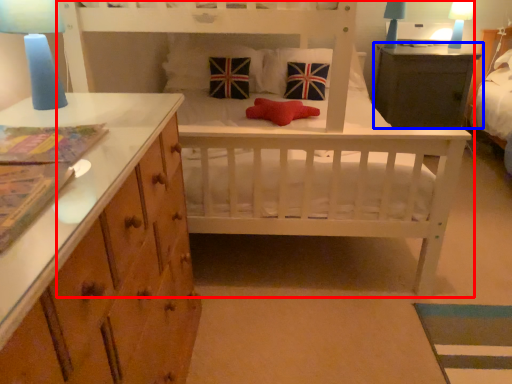
Question: Which object appears farthest to the camera in this image, infant bed (highlighted by a red box) or table (highlighted by a blue box)?

Choices:
 (A) infant bed
 (B) table

Answer: (B)